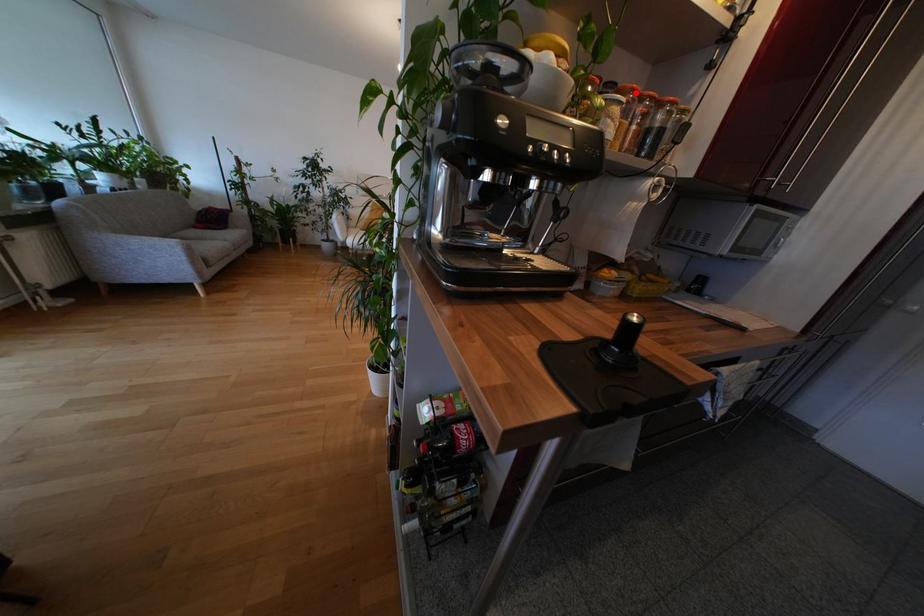
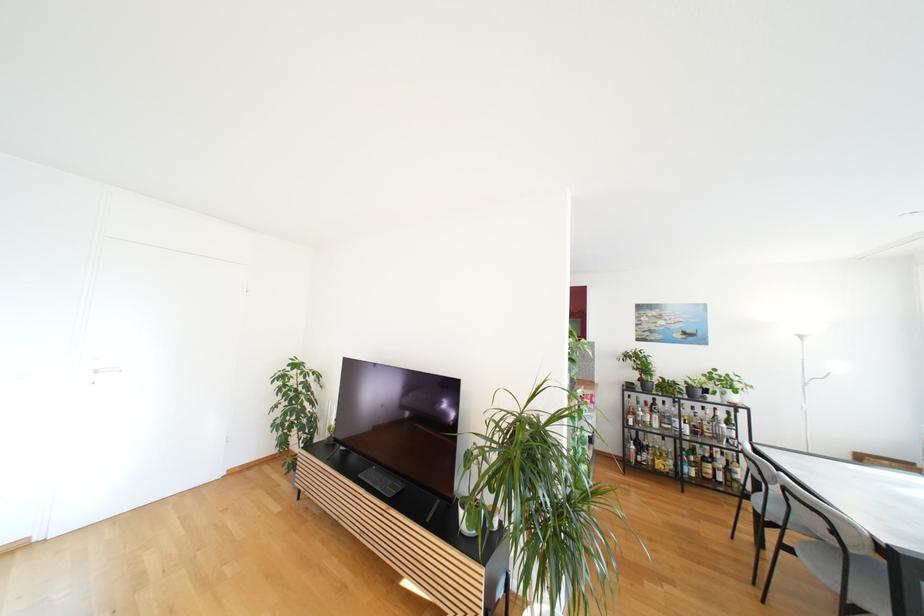
Question: I am providing you with two images of the same scene from different viewpoints. A red point is marked on the first image. Is the red point's position out of view in image 2?

Choices:
 (A) Yes
 (B) No

Answer: (A)